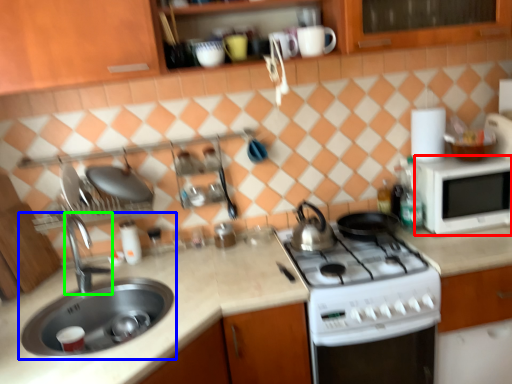
Question: Estimate the real-world distances between objects in this image. Which object is farther from microwave oven (highlighted by a red box), sink (highlighted by a blue box) or tap (highlighted by a green box)?

Choices:
 (A) sink
 (B) tap

Answer: (B)